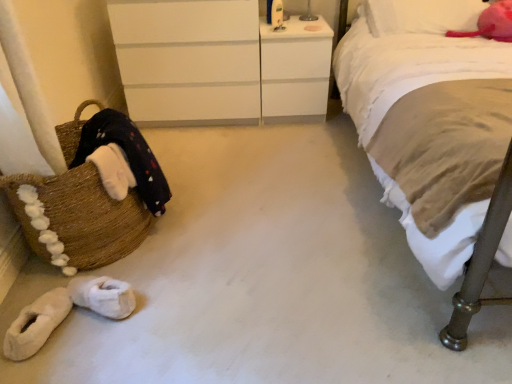
Image resolution: width=512 pixels, height=384 pixels. What are the coordinates of `free space on the front side of brown woven basket at left` in the screenshot? It's located at (125, 322).